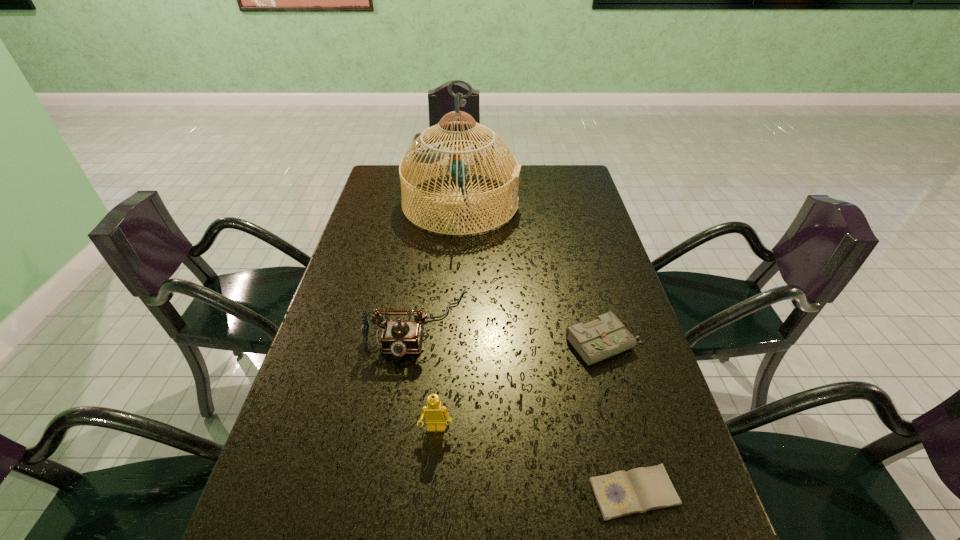
Locate an element on the screen. This screenshot has width=960, height=540. blank area at the far left corner is located at coordinates (379, 189).

You are a GUI agent. You are given a task and a screenshot of the screen. Output one action in this format:
    pyautogui.click(x=<x>, y=<y>)
    Task: Click on the vacant area at the far right corner of the desktop
    
    Given the screenshot: What is the action you would take?
    pyautogui.click(x=572, y=181)

Locate an element on the screen. Image resolution: width=960 pixels, height=540 pixels. vacant space in between the fourth tallest object and the nearer diary is located at coordinates (619, 418).

Identify the location of free spot between the birdcage and the Lego. (448, 316).

Find the location of `free space between the farthest object and the fourth farthest object`. free space between the farthest object and the fourth farthest object is located at coordinates (448, 316).

Find the location of a particular element. The width and height of the screenshot is (960, 540). empty space that is in between the second shortest object and the Lego is located at coordinates (520, 386).

Find the location of a particular element. This screenshot has height=540, width=960. free area in between the second shortest object and the farthest object is located at coordinates (533, 273).

Identify the location of unoccupied area between the birdcage and the shorter diary. Image resolution: width=960 pixels, height=540 pixels. (547, 348).

Identify the location of free space between the Lego and the taller diary. (520, 386).

Image resolution: width=960 pixels, height=540 pixels. I want to click on free space between the birdcage and the nearer diary, so click(547, 348).